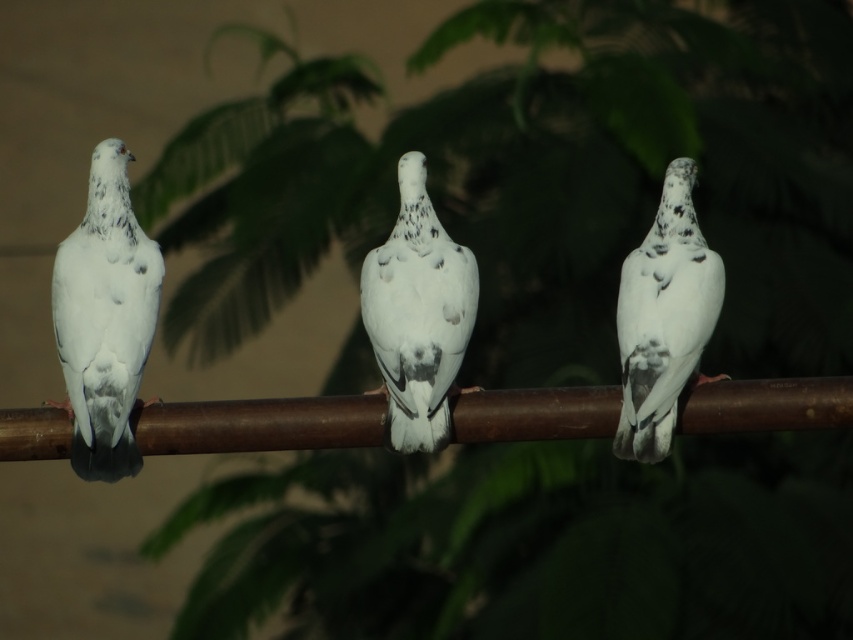
Does rusty metal branch at center have a greater width compared to speckled white bird at center?

Correct, the width of rusty metal branch at center exceeds that of speckled white bird at center.

Can you confirm if rusty metal branch at center is positioned to the right of speckled white bird at center?

Yes, rusty metal branch at center is to the right of speckled white bird at center.

Between point (289, 438) and point (386, 310), which one is positioned behind?

Point (386, 310)

Locate an element on the screen. rusty metal branch at center is located at coordinates (260, 424).

Is speckled white bird at center thinner than speckled white dove at right?

In fact, speckled white bird at center might be wider than speckled white dove at right.

Between speckled white bird at center and speckled white dove at right, which one has less height?

speckled white dove at right

Measure the distance between speckled white bird at center and camera.

speckled white bird at center is 4.34 meters away from camera.

Locate an element on the screen. speckled white bird at center is located at coordinates pyautogui.click(x=418, y=314).

Describe the element at coordinates (105, 317) in the screenshot. Image resolution: width=853 pixels, height=640 pixels. I see `speckled white pigeon at left` at that location.

Does speckled white pigeon at left have a smaller size compared to speckled white dove at right?

No.

Is point (93, 252) positioned behind point (643, 433)?

Yes, point (93, 252) is behind point (643, 433).

Locate an element on the screen. The height and width of the screenshot is (640, 853). speckled white pigeon at left is located at coordinates (105, 317).